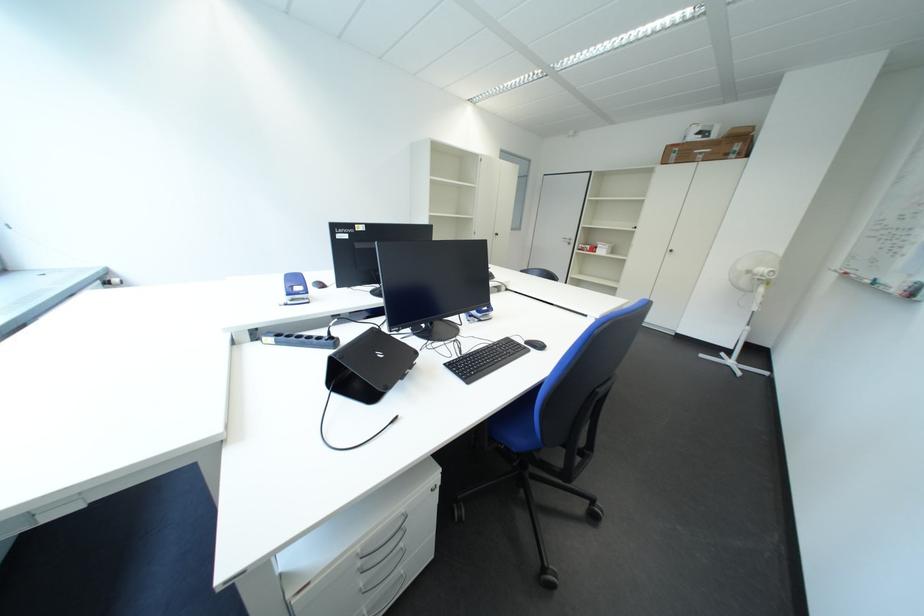
Where would you sit the chair sitting surface? Please return your answer as a coordinate pair (x, y).

(517, 424)